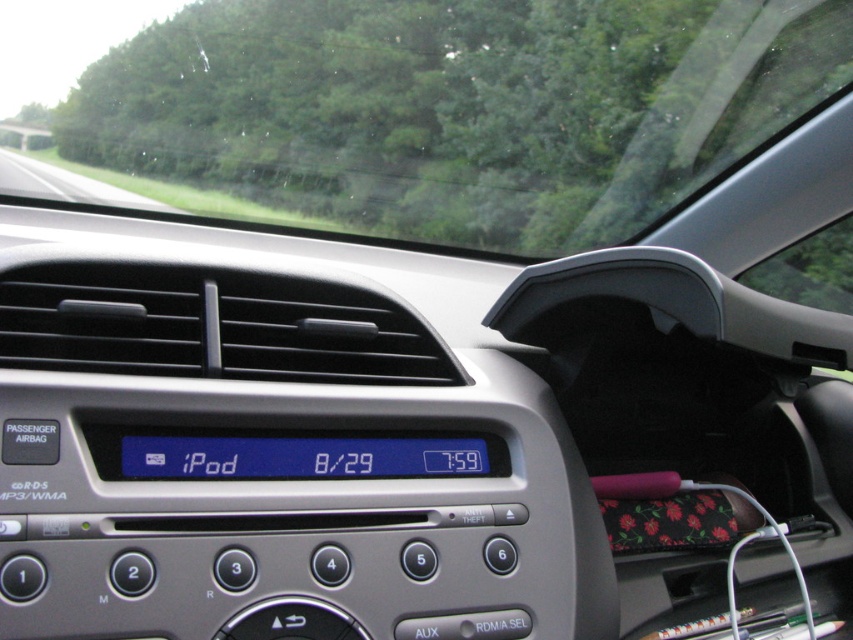
Between transparent glass windshield at upper center and blue lcd display at center, which one is positioned higher?

transparent glass windshield at upper center

What do you see at coordinates (436, 115) in the screenshot? I see `transparent glass windshield at upper center` at bounding box center [436, 115].

Between point (164, 72) and point (173, 472), which one is positioned behind?

Positioned behind is point (164, 72).

This screenshot has width=853, height=640. I want to click on transparent glass windshield at upper center, so click(436, 115).